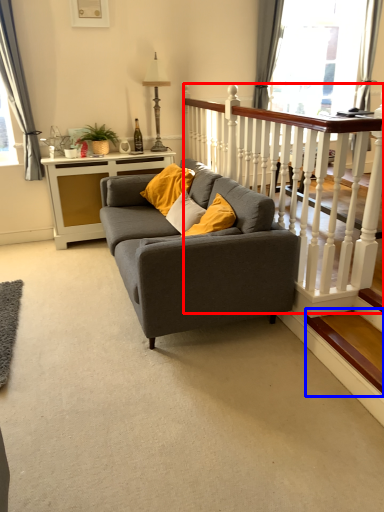
Question: Which object appears farthest to the camera in this image, balustrade (highlighted by a red box) or stairwell (highlighted by a blue box)?

Choices:
 (A) balustrade
 (B) stairwell

Answer: (A)